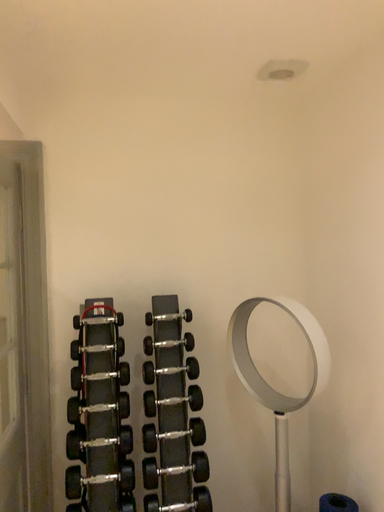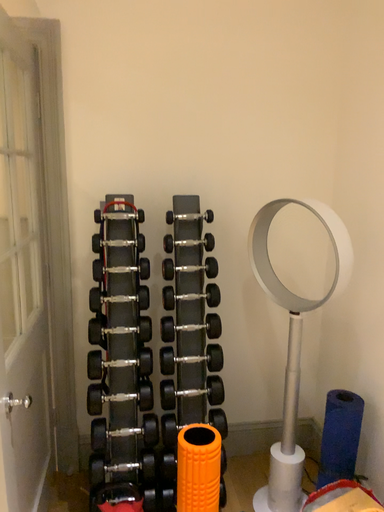
Question: Which way did the camera rotate in the video?

Choices:
 (A) rotated upward
 (B) rotated downward

Answer: (B)